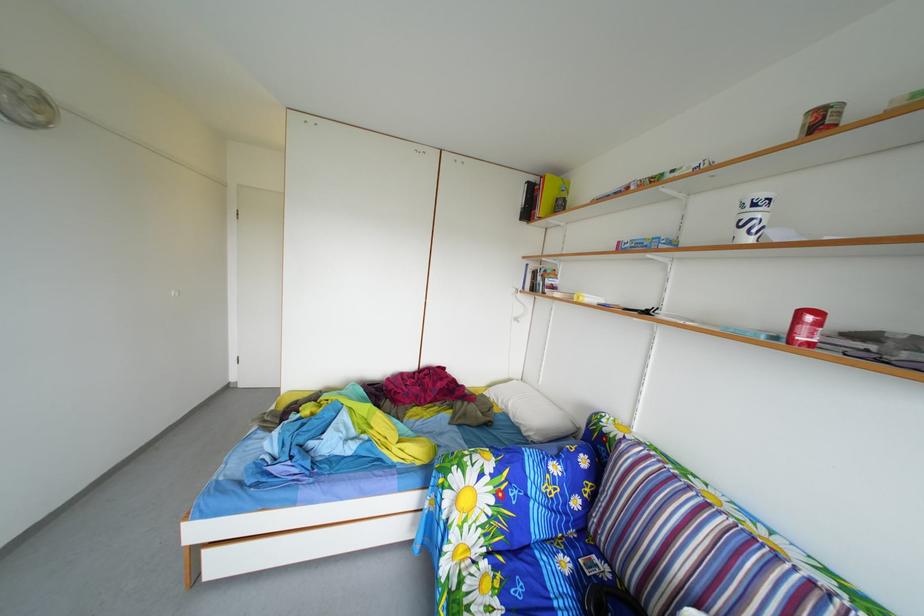
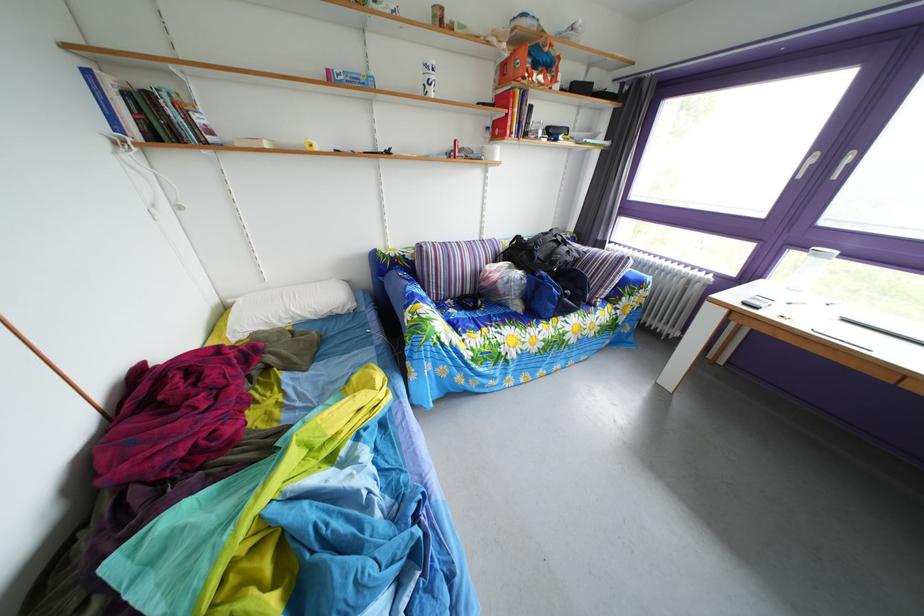
Where in the second image is the point corresponding to pixel 518 408 from the first image?

(298, 320)